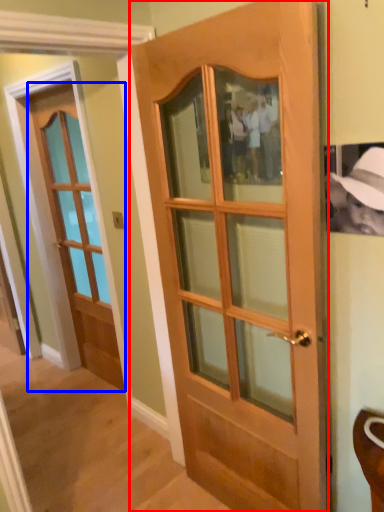
Question: Which object appears farthest to the camera in this image, door (highlighted by a red box) or door (highlighted by a blue box)?

Choices:
 (A) door
 (B) door

Answer: (B)